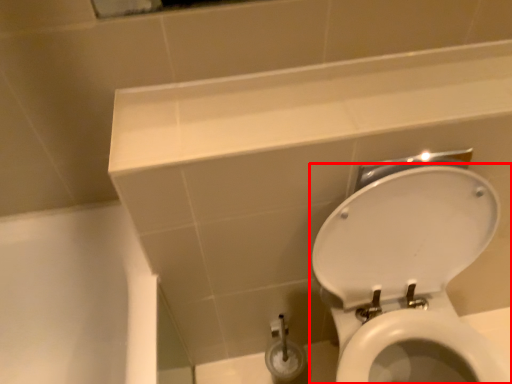
Question: From the image's perspective, where is toilet (annotated by the red box) located relative to ledge?

Choices:
 (A) below
 (B) above

Answer: (A)